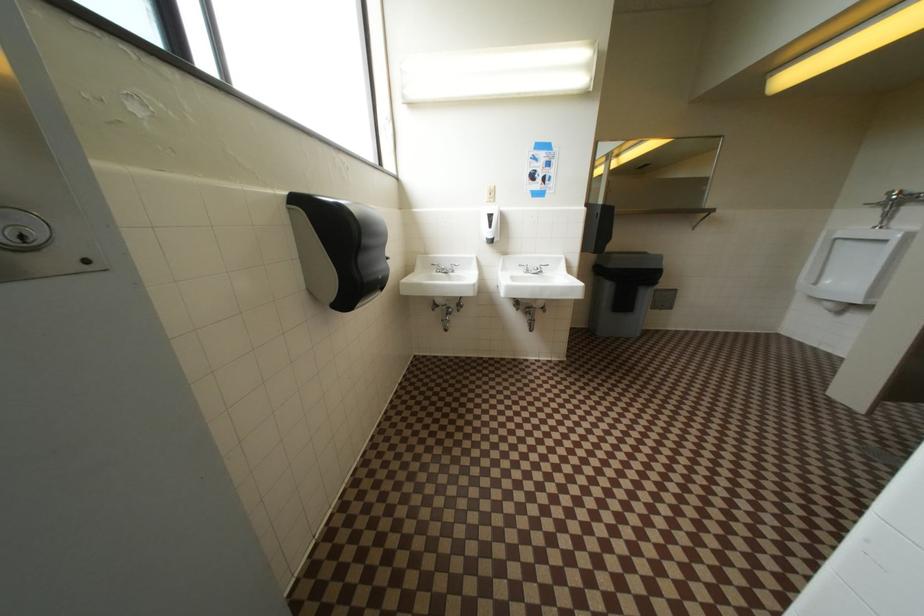
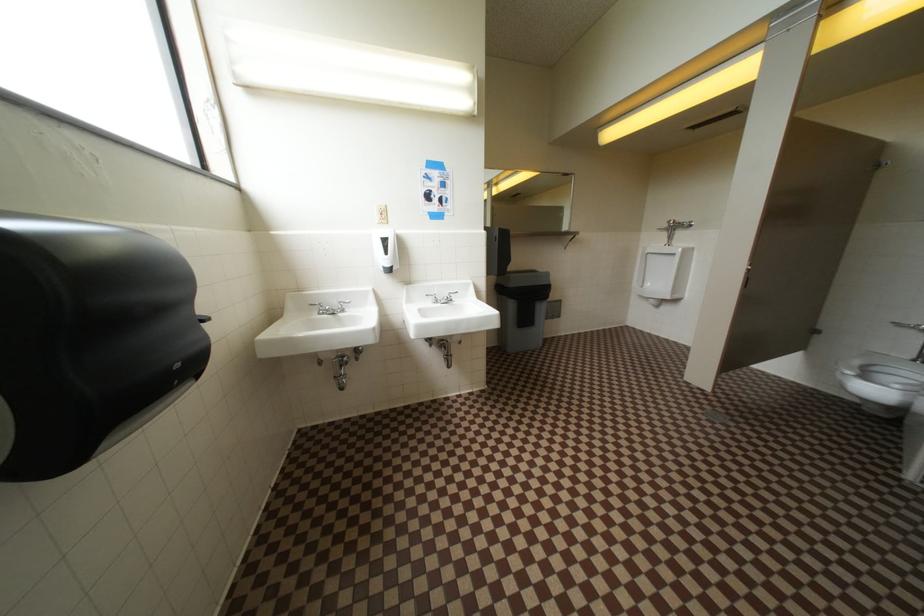
Question: The images are taken continuously from a first-person perspective. In which direction are you moving?

Choices:
 (A) Left
 (B) Right
 (C) Forward
 (D) Backward

Answer: (C)